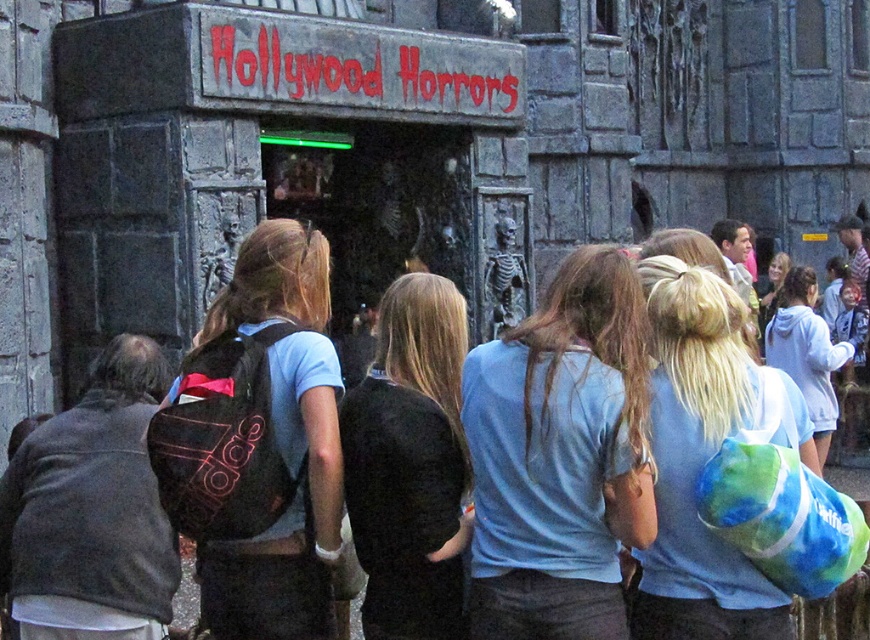
Question: Considering the real-world distances, which object is farthest from the blue cotton shirt at center?

Choices:
 (A) blue tie-dye backpack at center-right
 (B) white tie-dye hoodie at upper right

Answer: (B)

Question: Which of the following is the farthest from the observer?

Choices:
 (A) (720, 561)
 (B) (811, 342)
 (C) (239, 451)

Answer: (B)

Question: Is blue tie-dye backpack at center-right positioned in front of white tie-dye hoodie at upper right?

Choices:
 (A) no
 (B) yes

Answer: (B)

Question: Does black fabric backpack at center come behind white tie-dye hoodie at upper right?

Choices:
 (A) yes
 (B) no

Answer: (B)

Question: Can you confirm if dark gray sweater at left is positioned above black fabric shirt at center?

Choices:
 (A) no
 (B) yes

Answer: (A)

Question: Which point appears closest to the camera in this image?

Choices:
 (A) (385, 406)
 (B) (594, 580)
 (C) (817, 321)

Answer: (B)